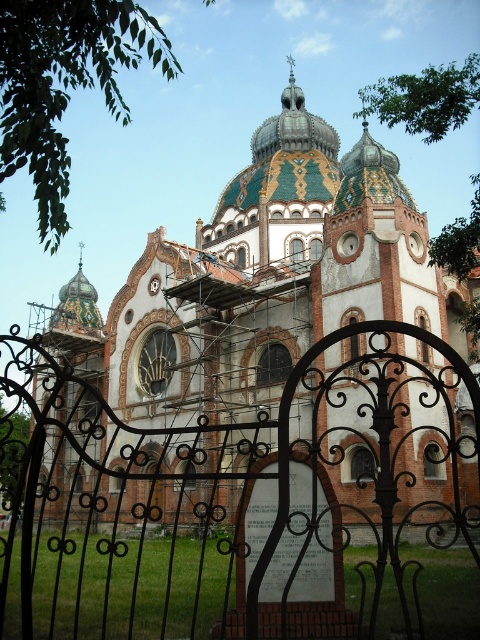
Question: Which point is farther to the camera?

Choices:
 (A) black wrought iron gate at center
 (B) brick church at center

Answer: (B)

Question: Which point is farther to the camera?

Choices:
 (A) brick church at center
 (B) black wrought iron gate at center

Answer: (A)

Question: Among these points, which one is nearest to the camera?

Choices:
 (A) (224, 417)
 (B) (373, 586)

Answer: (B)

Question: In this image, where is black wrought iron gate at center located relative to brick church at center?

Choices:
 (A) below
 (B) above

Answer: (A)

Question: Does black wrought iron gate at center have a greater width compared to brick church at center?

Choices:
 (A) yes
 (B) no

Answer: (A)

Question: Does black wrought iron gate at center appear on the left side of brick church at center?

Choices:
 (A) yes
 (B) no

Answer: (A)